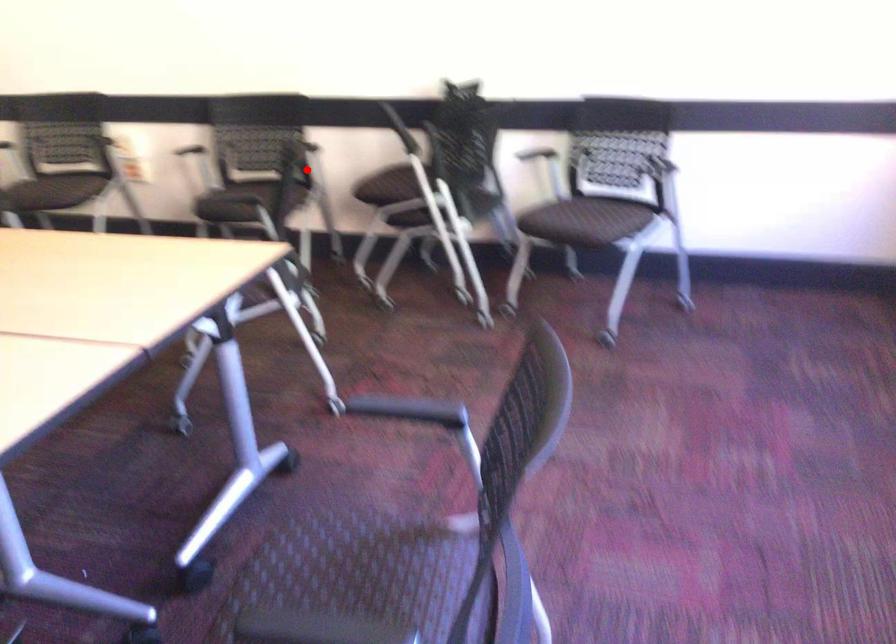
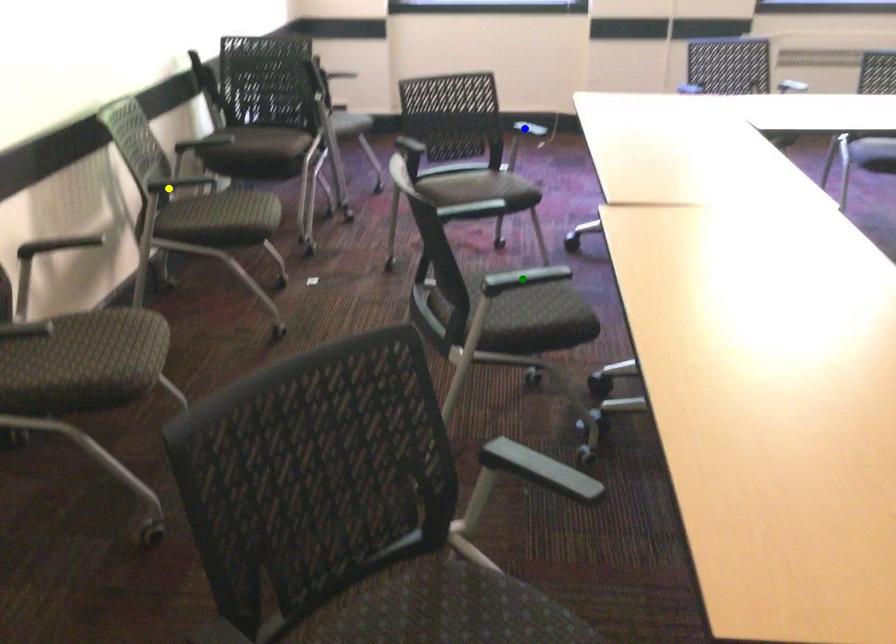
Question: I am providing you with two images of the same scene from different viewpoints. A red point is marked on the first image. You are given multiple points on the second image. Which mark in image 2 goes with the point in image 1?

Choices:
 (A) green point
 (B) yellow point
 (C) blue point

Answer: (B)